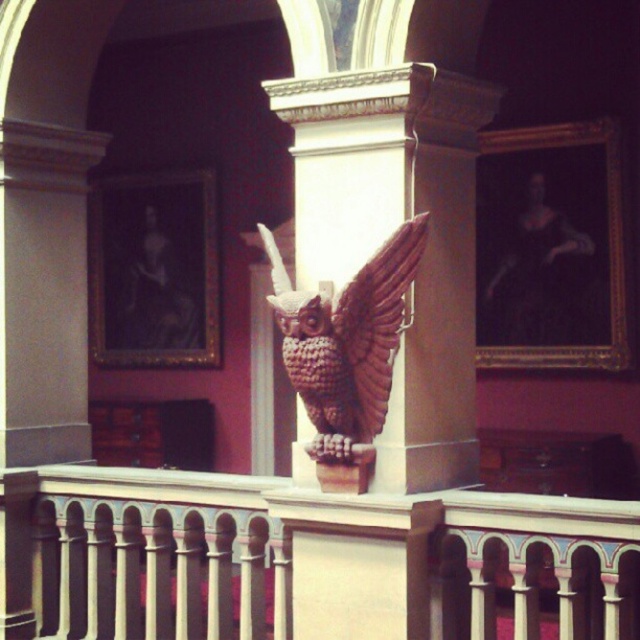
You are an interior designer planning to install a new light fixture in the center of this space. The existing white painted wood railing at center is located at point coordinates of (300,560). Would installing the light directly above this point interfere with the railing?

The point coordinates (300,560) indicate the location of the white painted wood railing at center. Installing the light directly above this point would place it right above the railing, potentially causing interference. Choose a different location to avoid obstruction.

You are standing in the ornate interior space and want to determine which of the two points, point (x=470, y=436) or point (x=340, y=328), is closer to you. Based on the scene description, which point is nearer?

Point (x=470, y=436) is further to the viewer than point (x=340, y=328), so point (x=340, y=328) is closer to you.